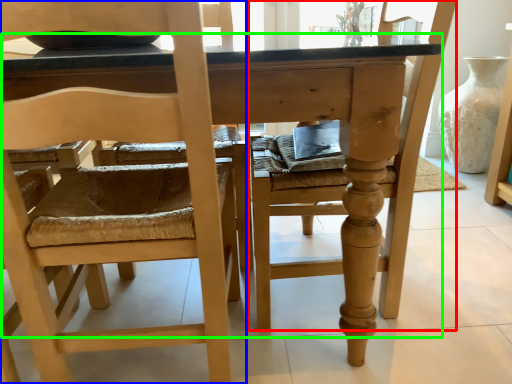
Question: Which object is positioned closest to chair (highlighted by a red box)? Select from chair (highlighted by a blue box) and table (highlighted by a green box).

Choices:
 (A) chair
 (B) table

Answer: (B)